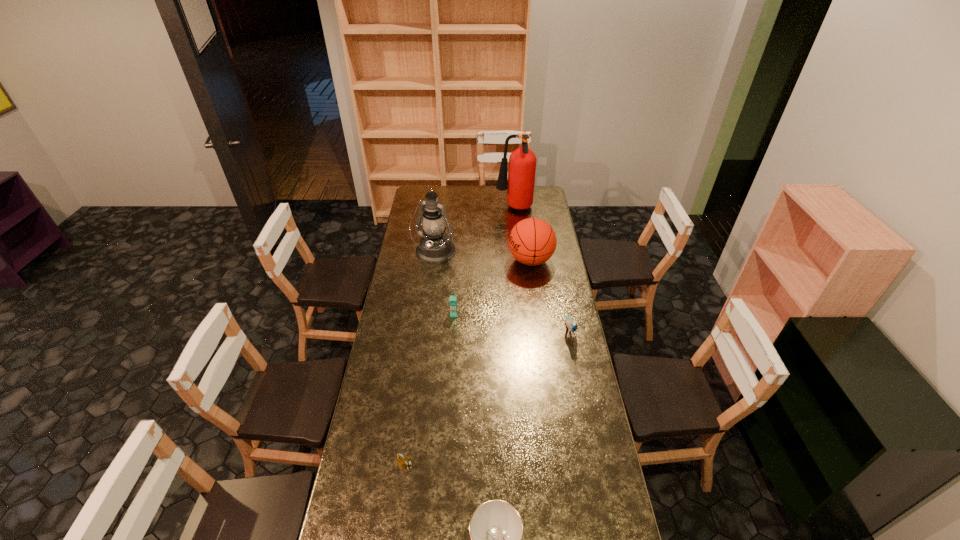
At what (x,y) coordinates should I click in order to perform the action: click on vacant point located between the sixth farthest object and the sixth shortest object. Please return your answer as a coordinate pair (x, y). Image resolution: width=960 pixels, height=540 pixels. Looking at the image, I should click on (420, 359).

Image resolution: width=960 pixels, height=540 pixels. Identify the location of unoccupied position between the second nearest object and the second tallest object. (420, 359).

Locate an element on the screen. free space between the cellular telephone and the third tallest object is located at coordinates (492, 287).

The height and width of the screenshot is (540, 960). I want to click on empty space that is in between the oil lamp and the padlock, so click(x=420, y=359).

This screenshot has height=540, width=960. Find the location of `free space between the third tallest object and the second tallest object`. free space between the third tallest object and the second tallest object is located at coordinates (483, 256).

The image size is (960, 540). In order to click on vacant space that's between the sixth shortest object and the basketball in this screenshot , I will do `click(483, 256)`.

Select which object appears as the fourth closest to the bird. Please provide its 2D coordinates. Your answer should be formatted as a tuple, i.e. [(x, y)], where the tuple contains the x and y coordinates of a point satisfying the conditions above.

[(496, 528)]

Identify which object is located as the fifth nearest to the cellular telephone. Please provide its 2D coordinates. Your answer should be formatted as a tuple, i.e. [(x, y)], where the tuple contains the x and y coordinates of a point satisfying the conditions above.

[(522, 162)]